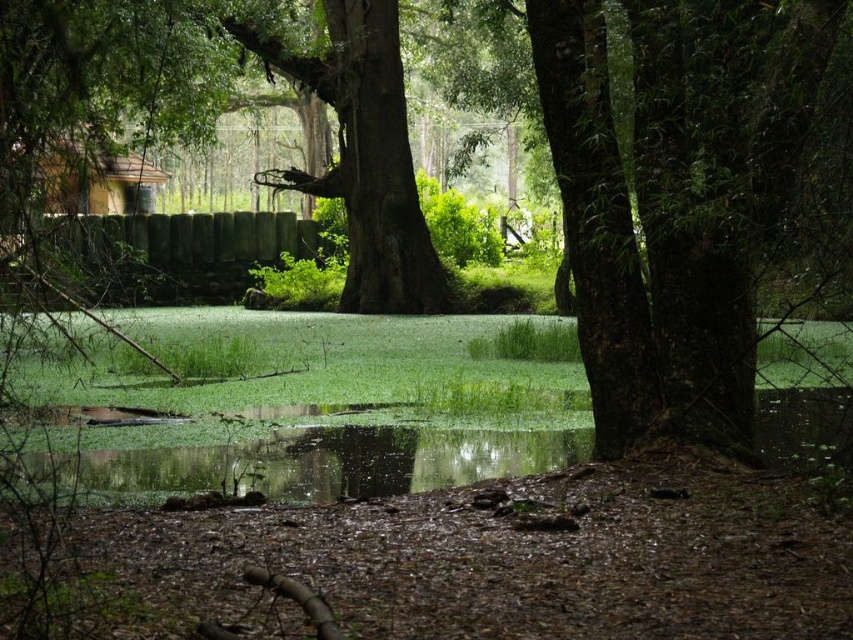
You are a photographer standing in the forest scene. You want to take a photo that includes both the point at coordinates point (351, 154) and point (94, 465). Which point should you focus on first to ensure both are in focus?

You should focus on point (351, 154) first because it is closer to the camera than point (94, 465). This ensures the foreground and background elements are in focus.

You are standing in the middle of the forest scene. There is a point marked at coordinates point (675, 200). What is the color of the surface where this point is located?

The point (675, 200) is on green textured bark at right, so the surface color is green.

You are a hiker trying to cross the stream. You see the smooth brown tree trunk at center and the green algae water at center. Which object is closer to you as you approach the stream?

The smooth brown tree trunk at center is closer to you because the green algae water at center is positioned behind it.